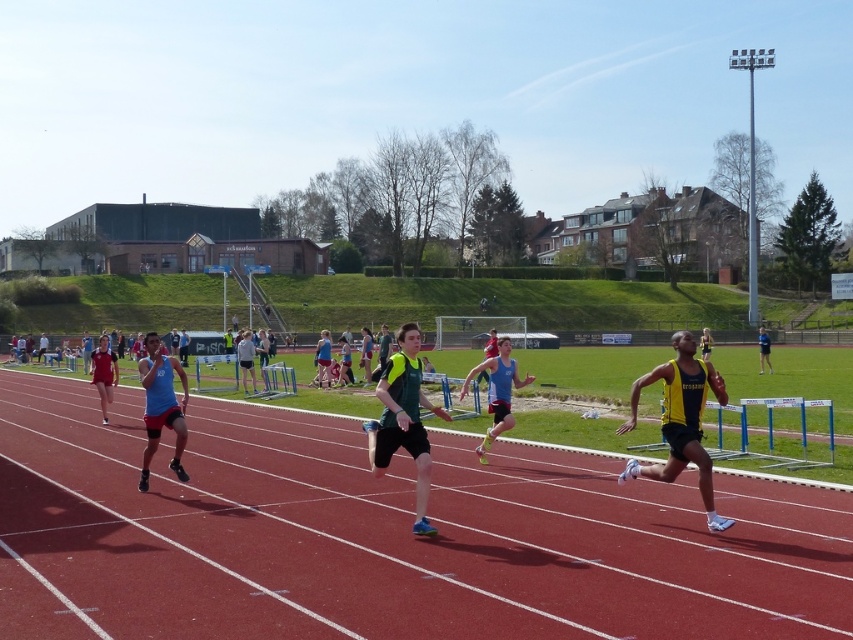
You are a photographer at the track and field event. You need to capture a photo that includes both the blue matte tank top at center and the matte red shorts at left. Based on their heights, which object should you focus on first to ensure both are in frame?

The blue matte tank top at center is shorter than the matte red shorts at left. To ensure both are in frame, focus on the taller matte red shorts at left first, then adjust to include the shorter blue matte tank top at center.

You are a photographer at the track and field event. You want to capture a photo of the blue fabric running suit at center and the matte red shorts at left. Which athlete is positioned higher in the frame?

The blue fabric running suit at center is positioned higher in the frame than the matte red shorts at left.